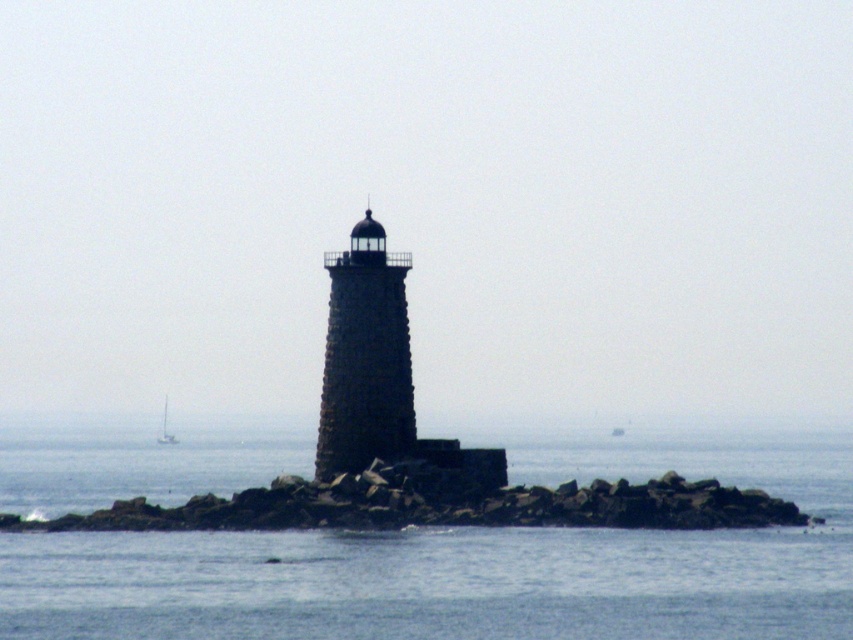
Is transparent water at center positioned behind white matte sailboat at lower left?

No.

Locate an element on the screen. transparent water at center is located at coordinates (476, 561).

Which is more to the right, transparent water at center or dark gray stone lighthouse at center?

transparent water at center is more to the right.

Which is below, transparent water at center or dark gray stone lighthouse at center?

transparent water at center

Which is in front, point (619, 593) or point (409, 372)?

Point (619, 593) is more forward.

Locate an element on the screen. The width and height of the screenshot is (853, 640). transparent water at center is located at coordinates (476, 561).

Does dark gray stone lighthouse at center appear on the right side of white matte sailboat at lower left?

Correct, you'll find dark gray stone lighthouse at center to the right of white matte sailboat at lower left.

Who is higher up, dark gray stone lighthouse at center or white matte sailboat at lower left?

dark gray stone lighthouse at center

Who is more forward, (335, 336) or (164, 410)?

Point (335, 336) is in front.

I want to click on dark gray stone lighthouse at center, so click(x=364, y=356).